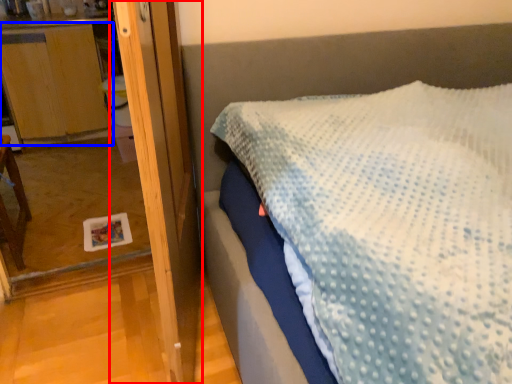
Question: Which point is closer to the camera, screen door (highlighted by a red box) or dresser (highlighted by a blue box)?

Choices:
 (A) screen door
 (B) dresser

Answer: (A)